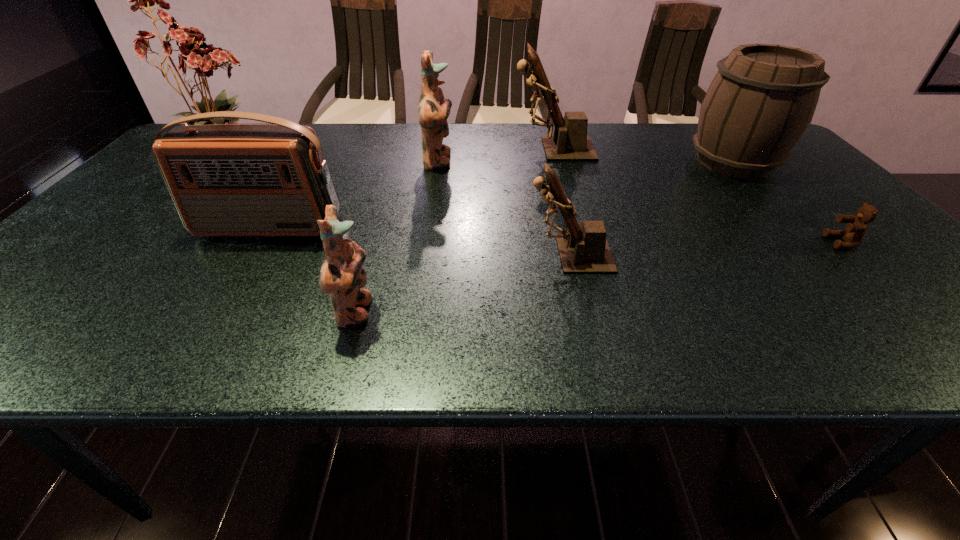
You are a GUI agent. You are given a task and a screenshot of the screen. Output one action in this format:
    pyautogui.click(x=<x>, y=<y>)
    Task: Click on the empty location between the radio receiver and the farther brown figurine
    This screenshot has width=960, height=540.
    Given the screenshot: What is the action you would take?
    pyautogui.click(x=411, y=189)

Locate an element on the screen. The image size is (960, 540). free space between the teddy bear and the wine bucket is located at coordinates (788, 202).

Where is `free space between the teddy bear and the third farthest figurine`? free space between the teddy bear and the third farthest figurine is located at coordinates (706, 249).

You are a GUI agent. You are given a task and a screenshot of the screen. Output one action in this format:
    pyautogui.click(x=<x>, y=<y>)
    Task: Click on the unoccupied area between the pink flower arrangement and the shortest object
    The width and height of the screenshot is (960, 540).
    Given the screenshot: What is the action you would take?
    pyautogui.click(x=537, y=199)

Locate an element on the screen. This screenshot has width=960, height=540. free space that is in between the farther brown figurine and the shortest object is located at coordinates (697, 196).

Where is `free point between the third farthest figurine and the nearer pink figurine`? The height and width of the screenshot is (540, 960). free point between the third farthest figurine and the nearer pink figurine is located at coordinates (462, 284).

Where is `empty location between the fifth object from right to left and the radio receiver`? The width and height of the screenshot is (960, 540). empty location between the fifth object from right to left and the radio receiver is located at coordinates (353, 195).

This screenshot has width=960, height=540. What are the coordinates of `object that is the sixth closest to the flower arrangement` in the screenshot? It's located at (761, 101).

This screenshot has width=960, height=540. What are the coordinates of `object that stands as the fourth closest to the brown wine bucket` in the screenshot? It's located at (434, 109).

This screenshot has height=540, width=960. I want to click on figurine object that ranks as the closest to the radio receiver, so click(342, 275).